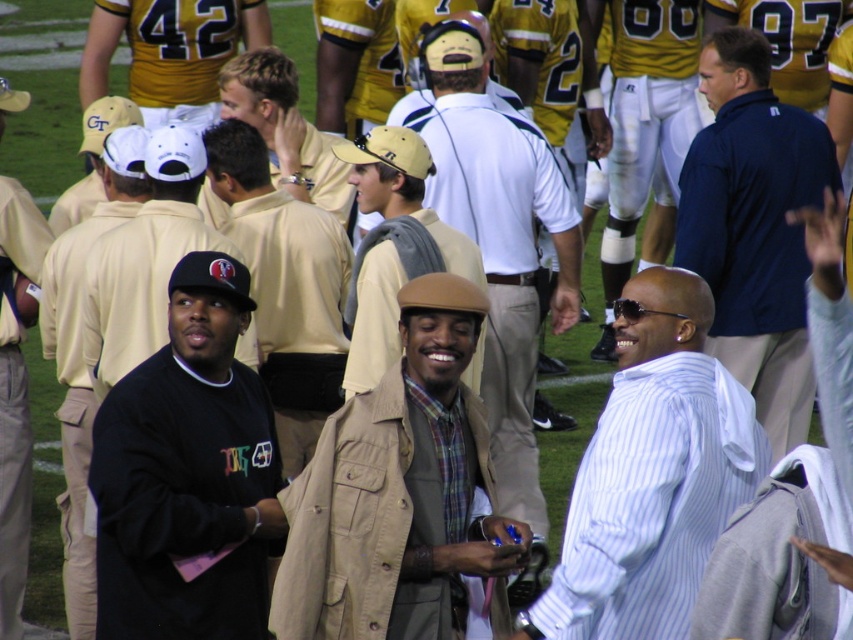
Does black matte sweatshirt at center appear over white striped shirt at center?

Incorrect, black matte sweatshirt at center is not positioned above white striped shirt at center.

Does point (171, 449) come closer to viewer compared to point (669, 484)?

No, (171, 449) is further to viewer.

This screenshot has height=640, width=853. Describe the element at coordinates (189, 474) in the screenshot. I see `black matte sweatshirt at center` at that location.

I want to click on black matte sweatshirt at center, so click(x=189, y=474).

Is black matte sweatshirt at center shorter than light brown leather jacket at center?

No, black matte sweatshirt at center is not shorter than light brown leather jacket at center.

Is point (207, 301) positioned before point (302, 164)?

Yes, it is in front of point (302, 164).

Who is more distant from viewer, (103, 412) or (288, 188)?

Point (288, 188)

Image resolution: width=853 pixels, height=640 pixels. I want to click on black matte sweatshirt at center, so click(x=189, y=474).

Can you confirm if white striped shirt at center is positioned to the right of tan suede beret at center?

Correct, you'll find white striped shirt at center to the right of tan suede beret at center.

Describe the element at coordinates (653, 474) in the screenshot. The height and width of the screenshot is (640, 853). I see `white striped shirt at center` at that location.

I want to click on white striped shirt at center, so click(653, 474).